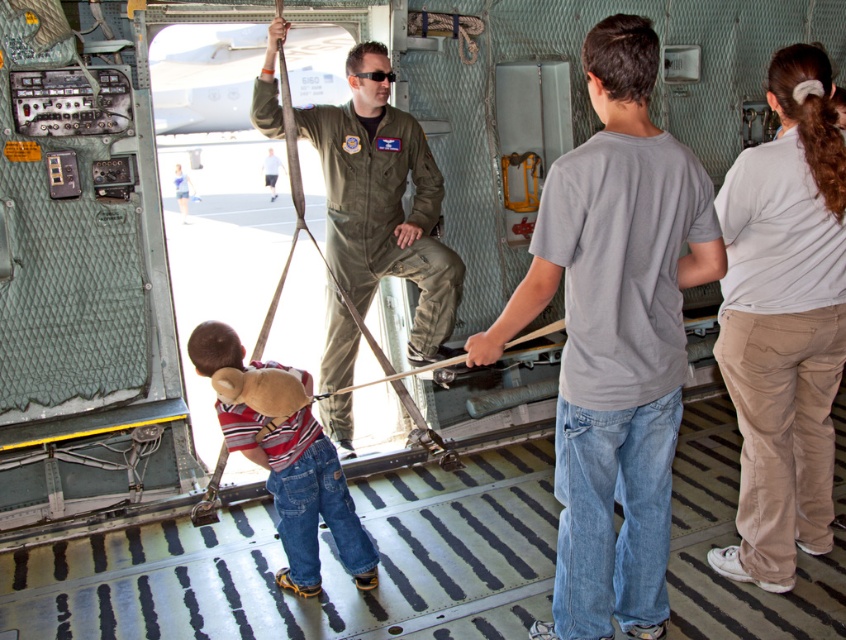
From the picture: Which of these two, gray cotton shirt at center or striped cotton shirt at center, stands shorter?

striped cotton shirt at center

Where is `gray cotton shirt at center`? The width and height of the screenshot is (846, 640). gray cotton shirt at center is located at coordinates (614, 337).

Is point (606, 440) closer to viewer compared to point (301, 568)?

Yes, point (606, 440) is closer to viewer.

This screenshot has height=640, width=846. Identify the location of gray cotton shirt at center. (614, 337).

Between white cotton shirt at upper right and green uniform at center, which one appears on the left side from the viewer's perspective?

green uniform at center is more to the left.

Does white cotton shirt at upper right come in front of green uniform at center?

Yes, it is in front of green uniform at center.

I want to click on white cotton shirt at upper right, so click(784, 321).

Identify the location of white cotton shirt at upper right. (784, 321).

Does white cotton shirt at upper right appear on the right side of striped cotton shirt at center?

Correct, you'll find white cotton shirt at upper right to the right of striped cotton shirt at center.

Does white cotton shirt at upper right have a lesser height compared to striped cotton shirt at center?

No, white cotton shirt at upper right is not shorter than striped cotton shirt at center.

Looking at this image, who is more forward, [799,513] or [360,538]?

Positioned in front is point [360,538].

This screenshot has width=846, height=640. In order to click on white cotton shirt at upper right in this screenshot , I will do `click(784, 321)`.